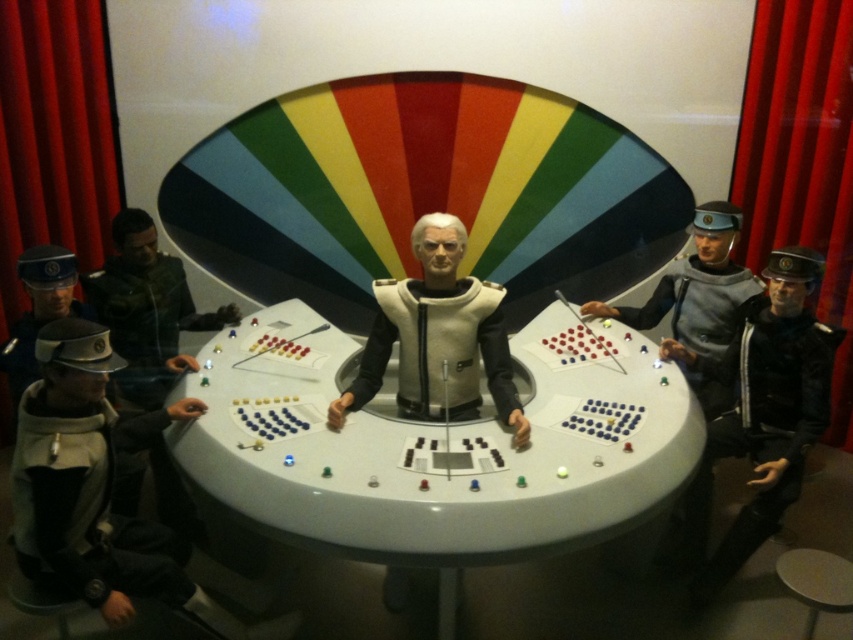
You are standing at the entrance of the control room and see the point marked at (431,451). What object is located at that point?

The white plastic round table at center is located at point (431,451).

From the picture: You are a delivery robot with a package that is 30 inches long. You need to place it between the white plastic round table at center and the black leather jacket at lower right. Is there enough space?

The distance between the white plastic round table at center and the black leather jacket at lower right is 29.29 inches. Since the package is 30 inches long, it will not fit in the available space.